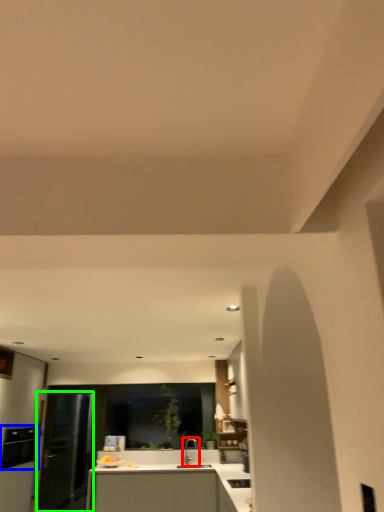
Question: Estimate the real-world distances between objects in this image. Which object is farther from tap (highlighted by a red box), appliance (highlighted by a blue box) or glass door (highlighted by a green box)?

Choices:
 (A) appliance
 (B) glass door

Answer: (A)